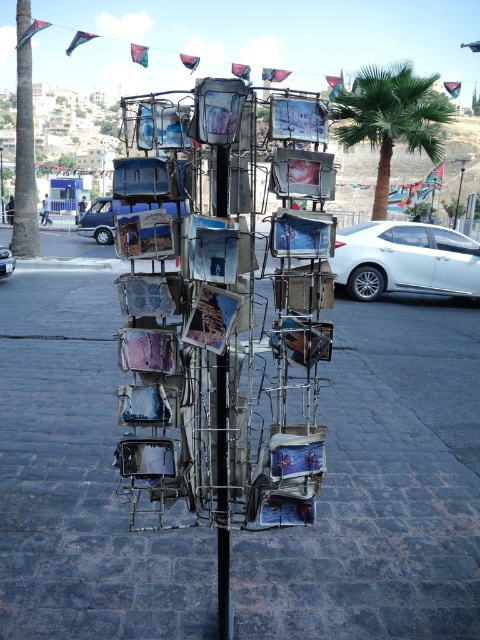
You are a photographer trying to capture a wide shot of the metallic photo frames at center without including the white metallic sedan at right in the frame. Based on their widths, can you position yourself in a way to achieve this?

The white metallic sedan at right is wider than the metallic photo frames at center. To avoid including the sedan in the frame, position yourself so that the sedan is outside the camera view while focusing on the narrower metallic photo frames at center.

You are standing on the cobblestone street and want to take a photo of the silver metallic car at center without including the metal post with frames in the background. Where should you position yourself relative to the car?

To avoid including the metal post with frames in the background when photographing the silver metallic car at center, position yourself to the left or right side of the car, as the post is situated behind it on the cobblestone street.

You are a delivery robot with a maximum turning radius of 3 meters. You need to navigate from the metallic gray pavement at center to the silver metallic car at center. Can you make the turn to reach the car without any issues?

The distance between metallic gray pavement at center and silver metallic car at center is 7.27 meters. Since your turning radius is 3 meters, you can safely navigate the turn as the distance allows for maneuvering within your capabilities.